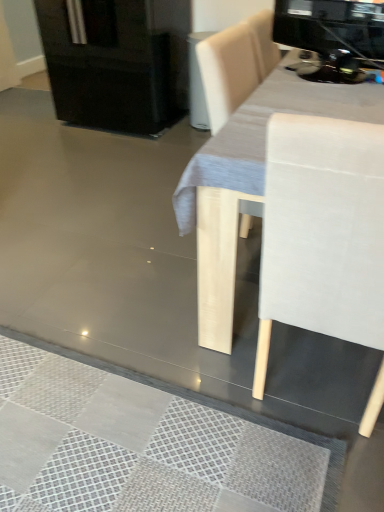
I want to click on black glossy fridge at upper left, so click(x=116, y=62).

In order to face black glossy fridge at upper left, should I rotate leftwards or rightwards?

To align with it, rotate left about 8.819°.

Describe the element at coordinates (116, 62) in the screenshot. I see `black glossy fridge at upper left` at that location.

The height and width of the screenshot is (512, 384). What do you see at coordinates (333, 34) in the screenshot?
I see `black glossy coffee machine at upper right` at bounding box center [333, 34].

Locate an element on the screen. The height and width of the screenshot is (512, 384). black glossy coffee machine at upper right is located at coordinates (333, 34).

Identify the location of black glossy fridge at upper left. This screenshot has height=512, width=384. (116, 62).

Between black glossy coffee machine at upper right and black glossy fridge at upper left, which one appears on the right side from the viewer's perspective?

black glossy coffee machine at upper right is more to the right.

Is black glossy coffee machine at upper right positioned in front of black glossy fridge at upper left?

Yes, it is.

Considering the points (376, 66) and (101, 125), which point is behind, point (376, 66) or point (101, 125)?

The point (101, 125) is more distant.

From the picture: From the image's perspective, is black glossy coffee machine at upper right under black glossy fridge at upper left?

Yes, from the image's perspective, black glossy coffee machine at upper right is below black glossy fridge at upper left.

From a real-world perspective, is black glossy coffee machine at upper right located higher than black glossy fridge at upper left?

Yes, from a real-world perspective, black glossy coffee machine at upper right is over black glossy fridge at upper left

Considering the relative sizes of black glossy coffee machine at upper right and black glossy fridge at upper left in the image provided, is black glossy coffee machine at upper right thinner than black glossy fridge at upper left?

Yes, black glossy coffee machine at upper right is thinner than black glossy fridge at upper left.

Is black glossy coffee machine at upper right taller than black glossy fridge at upper left?

No.

Between black glossy coffee machine at upper right and black glossy fridge at upper left, which one has smaller size?

With smaller size is black glossy coffee machine at upper right.

Which is correct: black glossy coffee machine at upper right is inside black glossy fridge at upper left, or outside of it?

The correct answer is: outside.

Consider the image. Does black glossy coffee machine at upper right touch black glossy fridge at upper left?

black glossy coffee machine at upper right and black glossy fridge at upper left are not in contact.

Does black glossy coffee machine at upper right turn towards black glossy fridge at upper left?

No, black glossy coffee machine at upper right is not aimed at black glossy fridge at upper left.

You are a GUI agent. You are given a task and a screenshot of the screen. Output one action in this format:
    pyautogui.click(x=<x>, y=<y>)
    Task: Click on the appliance below the black glossy fridge at upper left (from the image's perspective)
    
    Given the screenshot: What is the action you would take?
    click(333, 34)

Would you say black glossy fridge at upper left is to the left or to the right of black glossy coffee machine at upper right in the picture?

Clearly, black glossy fridge at upper left is on the left of black glossy coffee machine at upper right in the image.

Between black glossy fridge at upper left and black glossy coffee machine at upper right, which one is positioned behind?

black glossy fridge at upper left is further from the camera.

Which is nearer, [110,91] or [332,53]?

Clearly, point [110,91] is more distant from the camera than point [332,53].

From the image's perspective, is black glossy fridge at upper left above or below black glossy coffee machine at upper right?

black glossy fridge at upper left is situated higher than black glossy coffee machine at upper right in the image.

From a real-world perspective, which object rests below the other?

black glossy fridge at upper left.

Considering the relative sizes of black glossy fridge at upper left and black glossy coffee machine at upper right in the image provided, is black glossy fridge at upper left wider than black glossy coffee machine at upper right?

Yes, black glossy fridge at upper left is wider than black glossy coffee machine at upper right.

Considering the sizes of objects black glossy fridge at upper left and black glossy coffee machine at upper right in the image provided, who is taller, black glossy fridge at upper left or black glossy coffee machine at upper right?

Standing taller between the two is black glossy fridge at upper left.

Considering the relative sizes of black glossy fridge at upper left and black glossy coffee machine at upper right in the image provided, is black glossy fridge at upper left bigger than black glossy coffee machine at upper right?

Yes.

Is black glossy fridge at upper left completely or partially outside of black glossy coffee machine at upper right?

black glossy fridge at upper left is positioned outside black glossy coffee machine at upper right.

Is black glossy fridge at upper left far away from black glossy coffee machine at upper right?

Yes, black glossy fridge at upper left is far from black glossy coffee machine at upper right.

Is black glossy fridge at upper left oriented towards black glossy coffee machine at upper right?

No, black glossy fridge at upper left is not aimed at black glossy coffee machine at upper right.

How many degrees apart are the facing directions of black glossy fridge at upper left and black glossy coffee machine at upper right?

167 degrees separate the facing orientations of black glossy fridge at upper left and black glossy coffee machine at upper right.

Find the location of `appliance in front of the black glossy fridge at upper left`. appliance in front of the black glossy fridge at upper left is located at coordinates (333, 34).

Locate an element on the screen. This screenshot has height=512, width=384. appliance located in front of the black glossy fridge at upper left is located at coordinates (333, 34).

The width and height of the screenshot is (384, 512). I want to click on appliance that appears above the black glossy fridge at upper left (from a real-world perspective), so click(x=333, y=34).